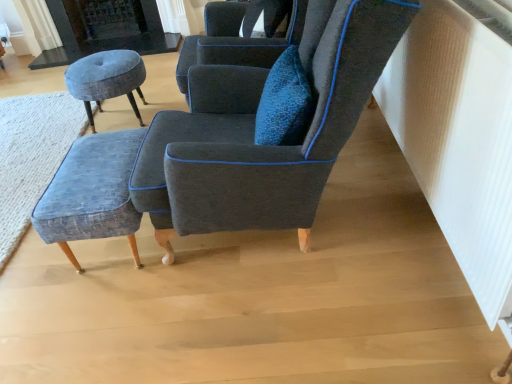
Identify the location of free space underneath velvet blue armchair at center, which is the first chair from front to back (from a real-world perspective). This screenshot has height=384, width=512. (290, 238).